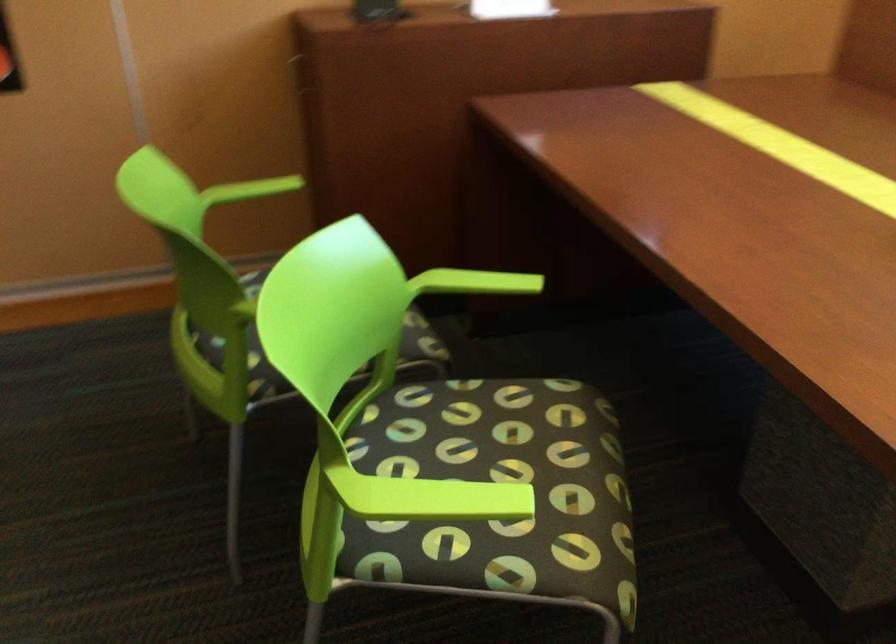
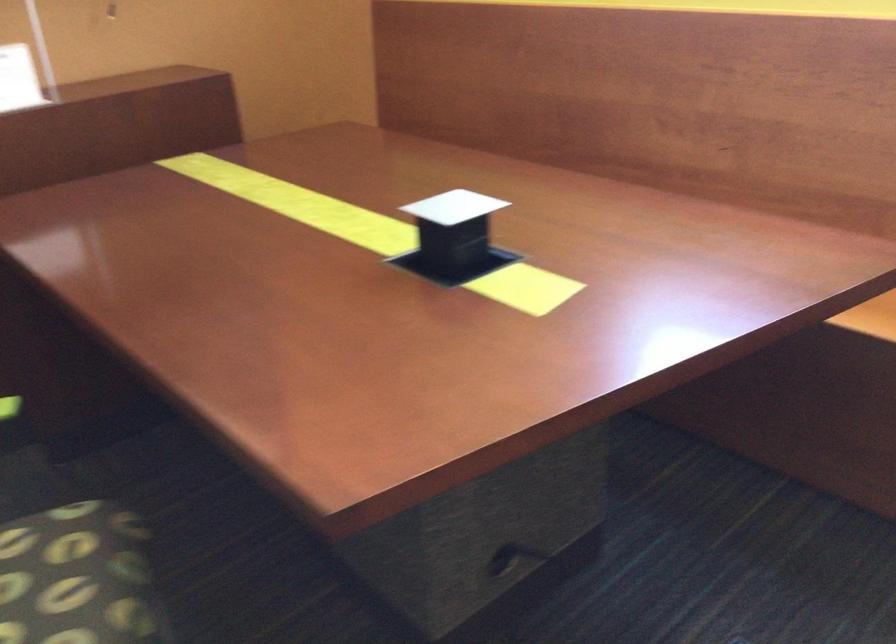
Question: What movement of the cameraman would produce the second image?

Choices:
 (A) Left
 (B) Right
 (C) Forward
 (D) Backward

Answer: (B)